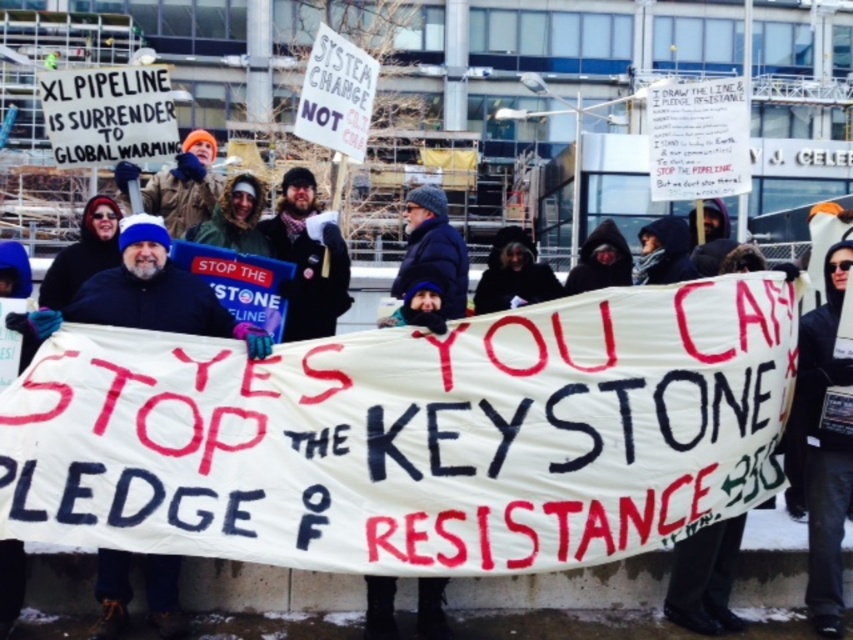
Question: Can you confirm if black hooded sweatshirt at center is positioned to the right of bearded man with scarf at center?

Choices:
 (A) no
 (B) yes

Answer: (B)

Question: Based on their relative distances, which object is farther from the bearded man with scarf at center?

Choices:
 (A) black hooded sweatshirt at center
 (B) white fabric banner at center

Answer: (A)

Question: Is black hooded sweatshirt at center above bearded man with scarf at center?

Choices:
 (A) yes
 (B) no

Answer: (B)

Question: Which point is closer to the camera?

Choices:
 (A) bearded man with scarf at center
 (B) white fabric banner at center
 (C) black hooded sweatshirt at center

Answer: (B)

Question: Which of the following is the farthest from the observer?

Choices:
 (A) white fabric banner at center
 (B) black hooded sweatshirt at center
 (C) bearded man with scarf at center

Answer: (C)

Question: Is white fabric banner at center further to the viewer compared to bearded man with scarf at center?

Choices:
 (A) yes
 (B) no

Answer: (B)